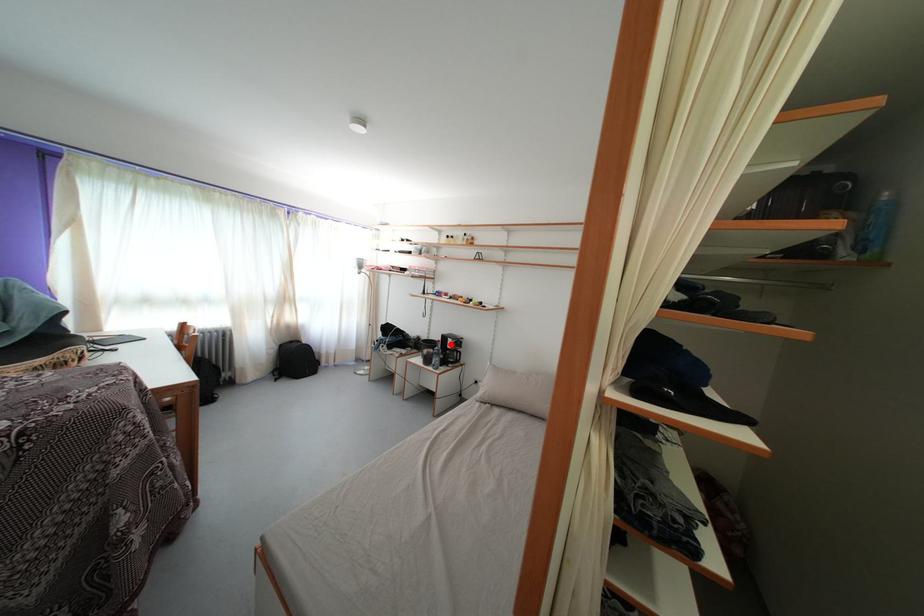
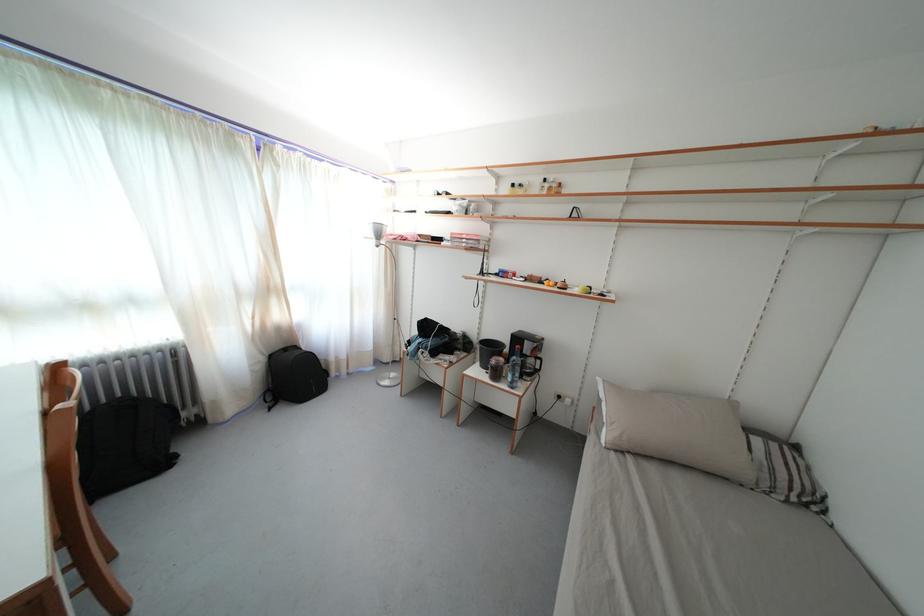
Locate, in the second image, the point that corresponds to the highlighted location in the first image.

(524, 345)